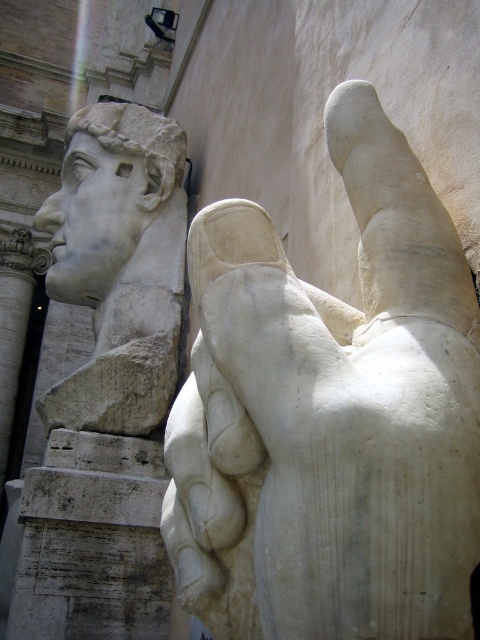
Question: Where is white marble hand at center located in relation to white marble head at upper left in the image?

Choices:
 (A) above
 (B) below

Answer: (B)

Question: Does white marble hand at center have a lesser width compared to white marble head at upper left?

Choices:
 (A) no
 (B) yes

Answer: (B)

Question: Can you confirm if white marble hand at center is wider than white marble head at upper left?

Choices:
 (A) yes
 (B) no

Answer: (B)

Question: Which point is closer to the camera taking this photo?

Choices:
 (A) (81, 300)
 (B) (387, 275)

Answer: (B)